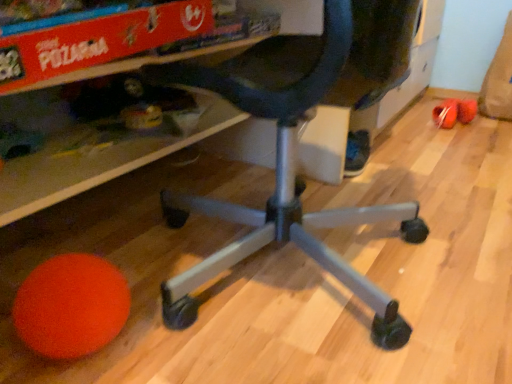
At what (x,y) coordinates should I click in order to perform the action: click on vacant space to the right of orange matte ball at lower left. Please return your answer as a coordinate pair (x, y). The height and width of the screenshot is (384, 512). Looking at the image, I should click on (185, 336).